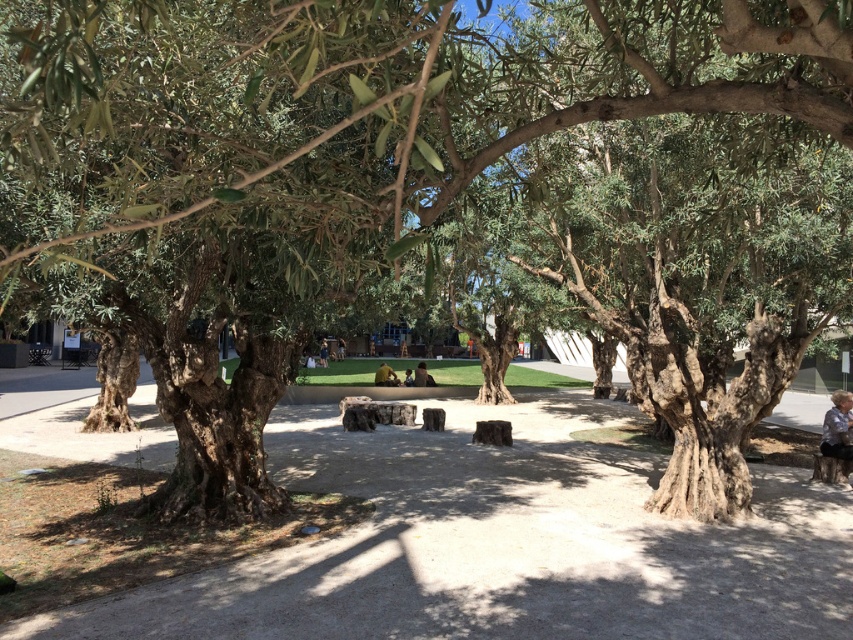
Is point (844, 435) farther from camera compared to point (321, 358)?

That is False.

Is point (831, 448) closer to viewer compared to point (322, 340)?

Yes, it is in front of point (322, 340).

Which is behind, point (836, 448) or point (325, 356)?

The point (325, 356) is more distant.

Find the location of a particular element. blue denim shirt at lower right is located at coordinates (838, 429).

Which of these two, yellow fabric person at center or dark brown leather jacket at center, stands taller?

With more height is dark brown leather jacket at center.

Is yellow fabric person at center wider than dark brown leather jacket at center?

Correct, the width of yellow fabric person at center exceeds that of dark brown leather jacket at center.

The width and height of the screenshot is (853, 640). I want to click on yellow fabric person at center, so click(386, 376).

Which is more to the right, blue denim shirt at lower right or dark brown leather jacket at center?

blue denim shirt at lower right is more to the right.

Is point (843, 413) less distant than point (422, 381)?

Yes, point (843, 413) is closer to viewer.

Locate an element on the screen. blue denim shirt at lower right is located at coordinates (838, 429).